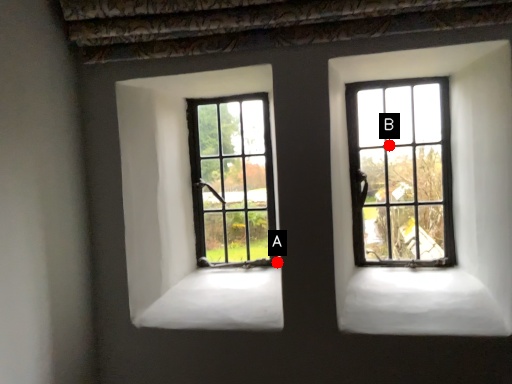
Question: Two points are circled on the image, labeled by A and B beside each circle. Among these points, which one is nearest to the camera?

Choices:
 (A) A is closer
 (B) B is closer

Answer: (B)